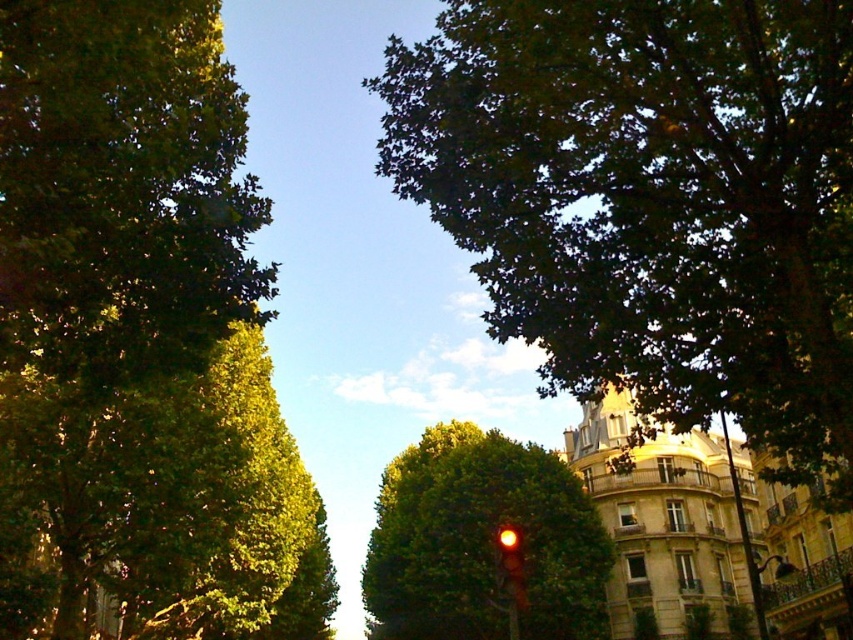
You are a pedestrian standing on the sidewalk and want to cross the street. You see the green leafy tree at upper left and the red glass traffic light at center. Which object is closer to you?

The green leafy tree at upper left is closer to the viewer than the red glass traffic light at center.

You are a pedestrian standing at the crosswalk and see the green leafy tree at upper right and the red glass traffic light at center. Which object is located to the right of the other?

The green leafy tree at upper right is positioned on the right side of red glass traffic light at center.